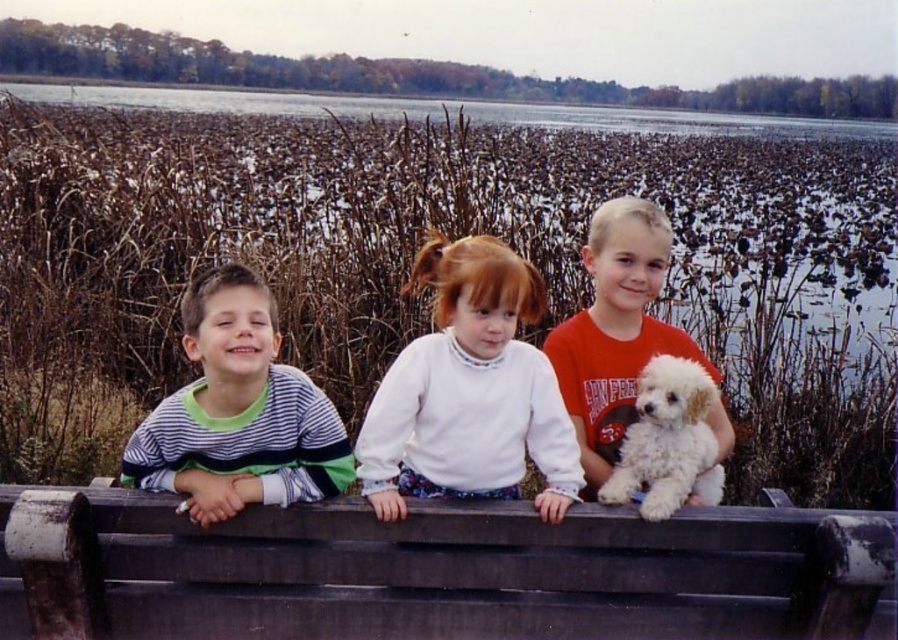
Question: Where is brown grass at center located in relation to white fleece sweater at center in the image?

Choices:
 (A) right
 (B) left

Answer: (B)

Question: Which object is positioned farthest from the white fluffy dog at right?

Choices:
 (A) white fleece sweater at center
 (B) clear water at upper center
 (C) brown grass at center
 (D) striped cotton shirt at left

Answer: (B)

Question: Estimate the real-world distances between objects in this image. Which object is farther from the dark brown wooden park bench at center?

Choices:
 (A) white fluffy dog at center
 (B) white fluffy dog at right

Answer: (B)

Question: From the image, what is the correct spatial relationship of striped cotton shirt at left in relation to white fluffy dog at center?

Choices:
 (A) right
 (B) left

Answer: (B)

Question: Which point appears closest to the camera in this image?

Choices:
 (A) (623, 394)
 (B) (436, 593)
 (C) (638, 436)
 (D) (288, 465)

Answer: (B)

Question: Can you confirm if white fluffy dog at right is positioned to the left of clear water at upper center?

Choices:
 (A) yes
 (B) no

Answer: (B)